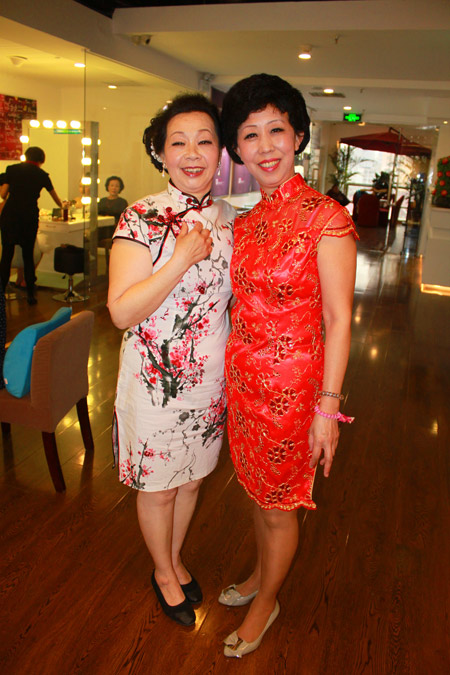
Locate an element on the screen. chairs is located at coordinates (54, 369), (70, 265).